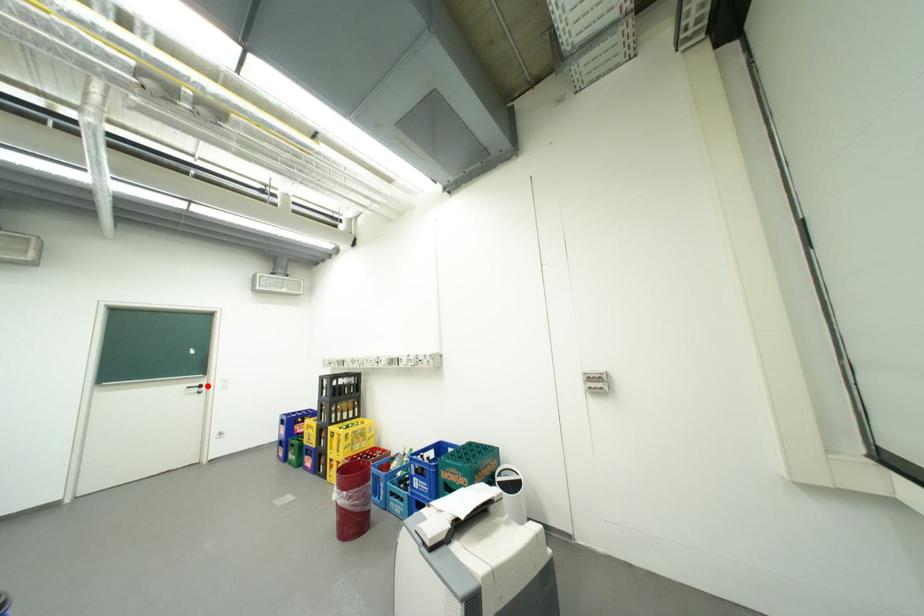
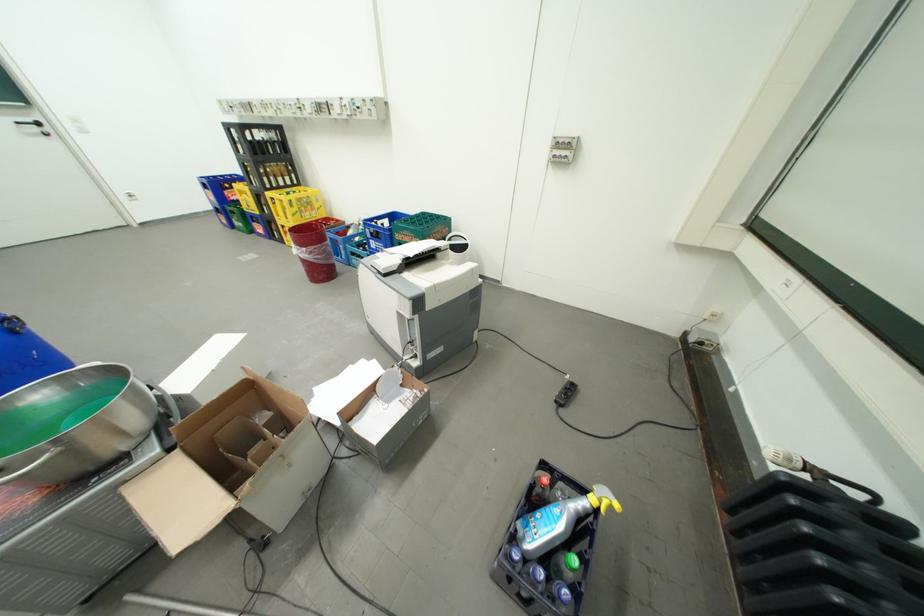
Find the pixel in the second image that matches the highlighted location in the first image.

(41, 122)